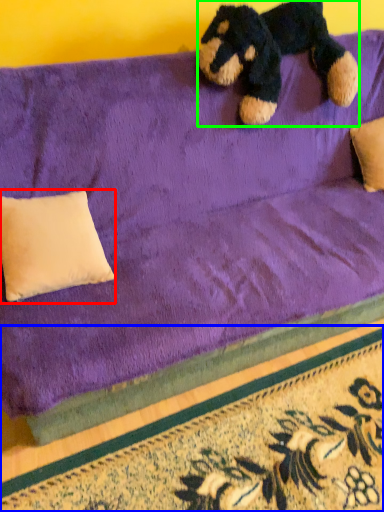
Question: Estimate the real-world distances between objects in this image. Which object is closer to pillow (highlighted by a red box), doormat (highlighted by a blue box) or teddy bear (highlighted by a green box)?

Choices:
 (A) doormat
 (B) teddy bear

Answer: (A)